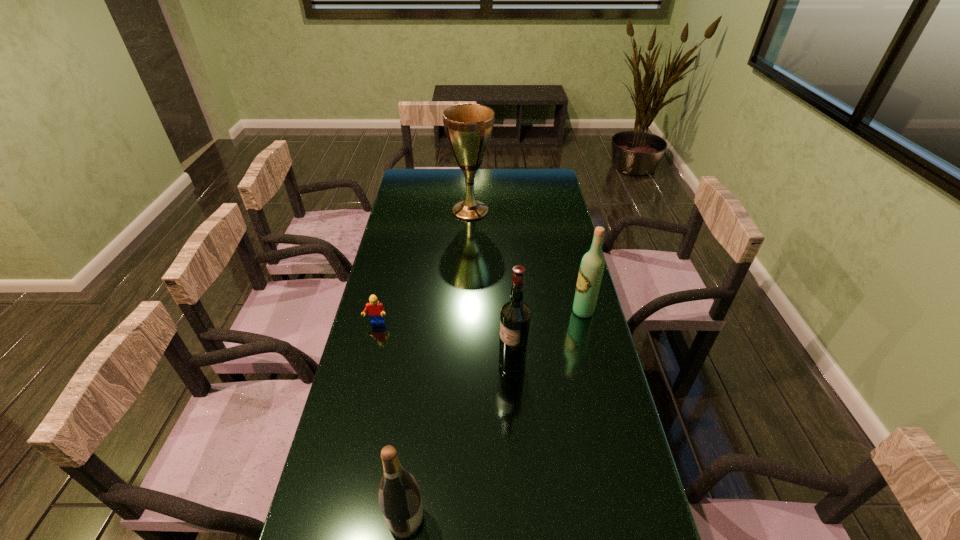
The height and width of the screenshot is (540, 960). What are the coordinates of `free spot between the second nearest object and the rightmost wine bottle` in the screenshot? It's located at (547, 339).

Select which object appears as the third closest to the farthest wine bottle. Please provide its 2D coordinates. Your answer should be formatted as a tuple, i.e. [(x, y)], where the tuple contains the x and y coordinates of a point satisfying the conditions above.

[(375, 309)]

Select which object is the fourth closest to the Lego. Please provide its 2D coordinates. Your answer should be formatted as a tuple, i.e. [(x, y)], where the tuple contains the x and y coordinates of a point satisfying the conditions above.

[(591, 269)]

The width and height of the screenshot is (960, 540). I want to click on the closest wine bottle to the rightmost object, so click(515, 315).

Locate an element on the screen. wine bottle that is the closest one to the farthest object is located at coordinates (591, 269).